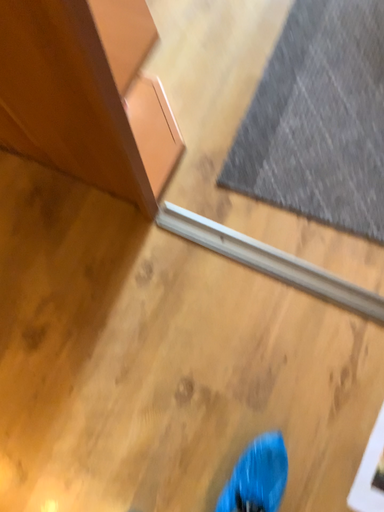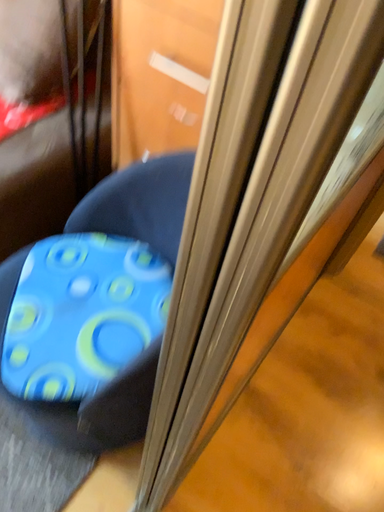
Question: Which way did the camera rotate in the video?

Choices:
 (A) rotated downward
 (B) rotated upward

Answer: (B)